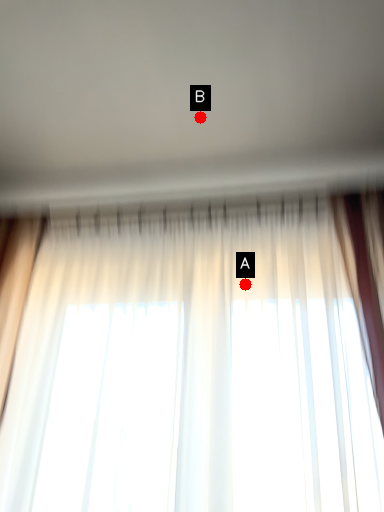
Question: Two points are circled on the image, labeled by A and B beside each circle. Which point is closer to the camera taking this photo?

Choices:
 (A) A is closer
 (B) B is closer

Answer: (B)